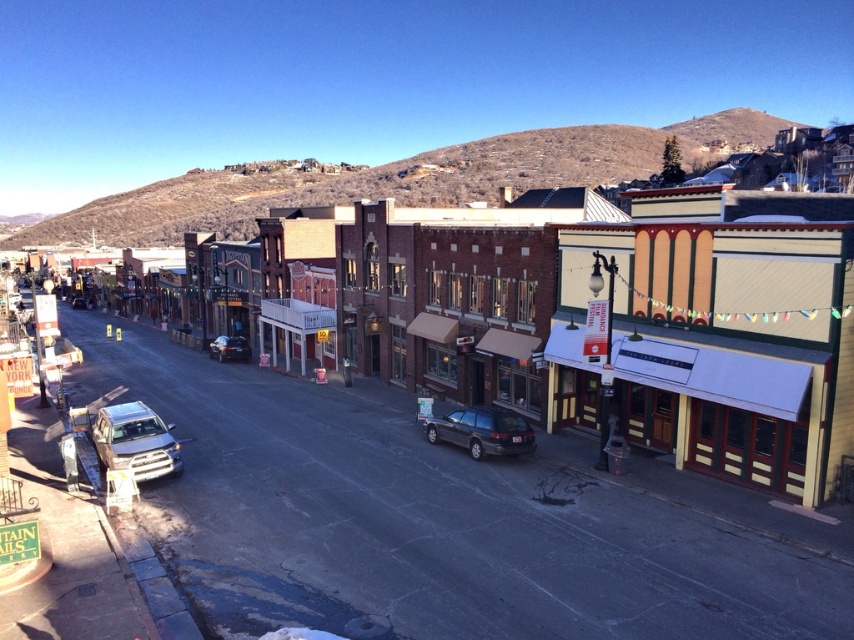
Which is more to the right, satin silver suv at lower left or satin silver sedan at center?

Positioned to the right is satin silver suv at lower left.

Consider the image. Does satin silver suv at lower left appear on the right side of satin silver sedan at center?

Indeed, satin silver suv at lower left is positioned on the right side of satin silver sedan at center.

Does point (147, 424) come behind point (80, 307)?

No, (147, 424) is closer to viewer.

Where is `satin silver suv at lower left`? satin silver suv at lower left is located at coordinates (135, 442).

Image resolution: width=854 pixels, height=640 pixels. What do you see at coordinates (483, 429) in the screenshot?
I see `dark gray matte station wagon at center` at bounding box center [483, 429].

Where is `dark gray matte station wagon at center`? dark gray matte station wagon at center is located at coordinates (483, 429).

At what (x,y) coordinates should I click in order to perform the action: click on dark gray matte station wagon at center. Please return your answer as a coordinate pair (x, y). Image resolution: width=854 pixels, height=640 pixels. Looking at the image, I should click on (483, 429).

Does brick building at center come in front of dark gray matte station wagon at center?

Yes.

Can you confirm if brick building at center is bigger than dark gray matte station wagon at center?

Yes.

Is point (366, 289) farther from viewer compared to point (437, 436)?

Yes.

Where is `brick building at center`? The image size is (854, 640). brick building at center is located at coordinates (613, 317).